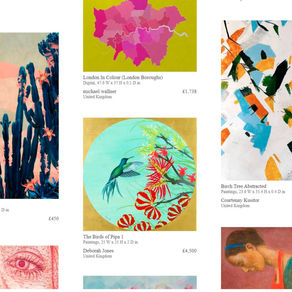
Locate an element on the screen. This screenshot has width=292, height=292. artwork / painting is located at coordinates (274, 112).